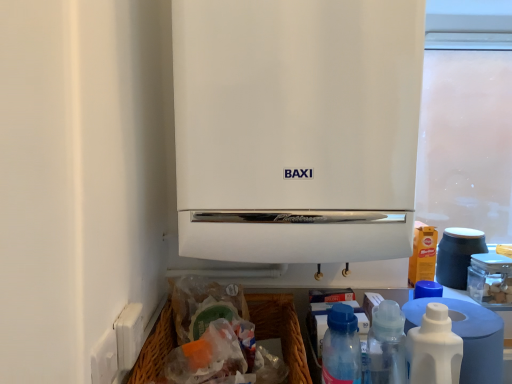
Question: Is white matte boiler at center taller or shorter than blue translucent bottle at lower right, which appears as the 2th bottle when viewed from the right?

Choices:
 (A) tall
 (B) short

Answer: (A)

Question: Is white matte boiler at center spatially inside blue translucent bottle at lower right, which appears as the 2th bottle when viewed from the right, or outside of it?

Choices:
 (A) inside
 (B) outside

Answer: (B)

Question: Considering the real-world distances, which object is closest to the blue translucent bottle at lower right, arranged as the first bottle when viewed from the left?

Choices:
 (A) white matte boiler at center
 (B) matte blue cup at right
 (C) white plastic bottle at lower right, the first bottle from the right
 (D) woven brown basket at lower center

Answer: (C)

Question: Which object is positioned farthest from the woven brown basket at lower center?

Choices:
 (A) white plastic bottle at lower right, which appears as the second bottle when viewed from the left
 (B) matte blue cup at right
 (C) white matte boiler at center
 (D) blue translucent bottle at lower right, which appears as the 2th bottle when viewed from the right

Answer: (B)